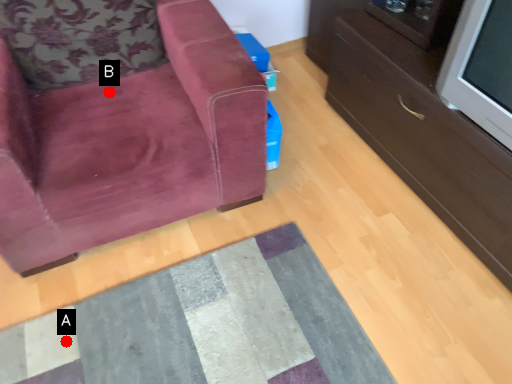
Question: Two points are circled on the image, labeled by A and B beside each circle. Which point is closer to the camera taking this photo?

Choices:
 (A) A is closer
 (B) B is closer

Answer: (A)